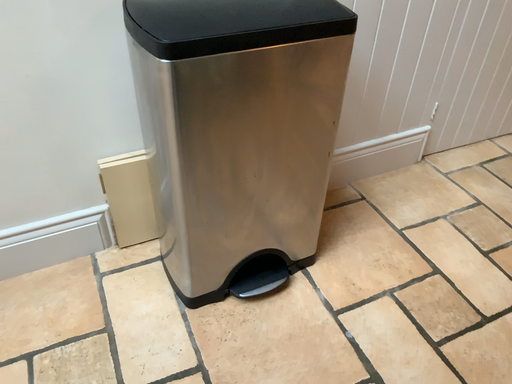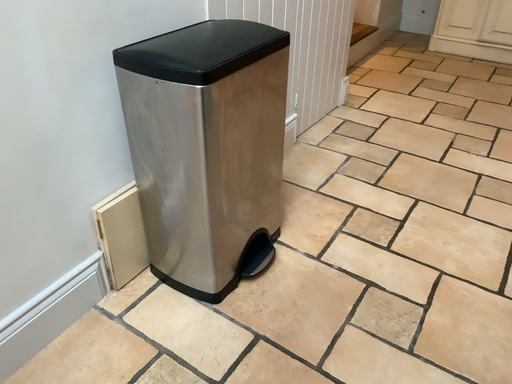
Question: Which way did the camera rotate in the video?

Choices:
 (A) rotated right
 (B) rotated left

Answer: (A)